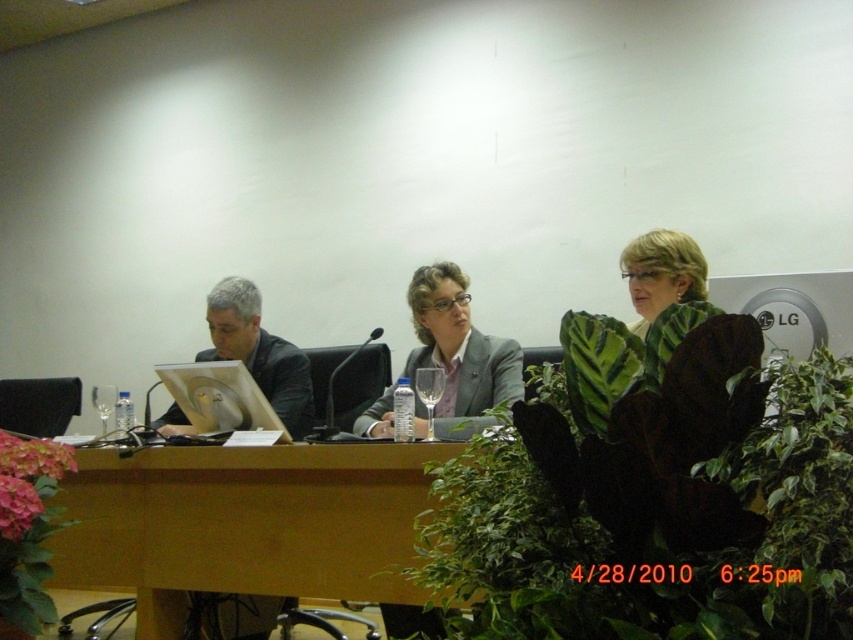
Question: Which point is farther from the camera taking this photo?

Choices:
 (A) click(x=656, y=301)
 (B) click(x=236, y=561)

Answer: (A)

Question: Does matte black laptop at left have a smaller size compared to blonde hair at center?

Choices:
 (A) yes
 (B) no

Answer: (B)

Question: Is brown wood table at center to the left of matte black laptop at left from the viewer's perspective?

Choices:
 (A) yes
 (B) no

Answer: (B)

Question: In this image, where is brown wood table at center located relative to matte black laptop at left?

Choices:
 (A) left
 (B) right

Answer: (B)

Question: Estimate the real-world distances between objects in this image. Which object is closer to the blonde hair at center?

Choices:
 (A) matte black laptop at left
 (B) green leafy plant at center
 (C) pink matte flower at lower left
 (D) brown wood table at center

Answer: (D)

Question: Among these objects, which one is farthest from the camera?

Choices:
 (A) green leafy plant at center
 (B) matte black laptop at left
 (C) blonde hair at center
 (D) brown wood table at center

Answer: (B)